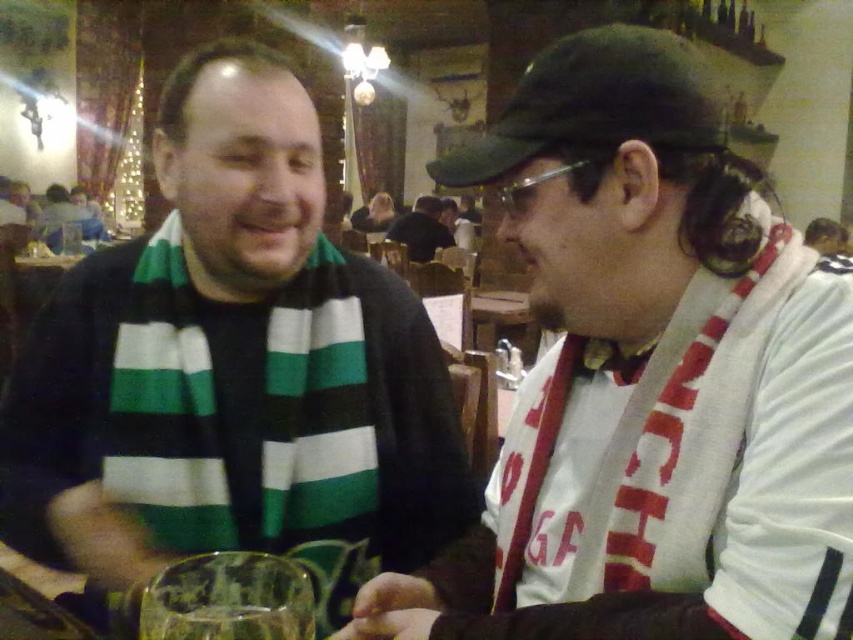
You are a photographer trying to capture the scene from the perspective of the person wearing the HFC jacket. In the image you see, where is the white fabric scarf at center in relation to the translucent glass at lower center?

The white fabric scarf at center is to the right of the translucent glass at lower center.

Based on the photo, you are a photographer standing in front of the scene. You want to focus on the person on the left wearing a black sweater with green and white stripes. Which of the two points, point 1 at coordinates (688, 298) or point 2 at coordinates (194, 616), is closer to the camera and thus better for focusing on the person on the left?

Point 2 at coordinates (194, 616) is closer to the camera than point 1 at coordinates (688, 298). Therefore, focusing on point 2 would be better to capture the person on the left wearing a black sweater with green and white stripes.

You are standing in a restaurant and want to take a photo of the point at coordinates point (x=318, y=465). If your camera can focus on objects within 40 inches, will it be able to capture the point clearly?

The distance between the point (x=318, y=465) and the viewer is 37.99 inches, which is within the camera focus range of 40 inches. Therefore, the camera should be able to capture the point clearly.